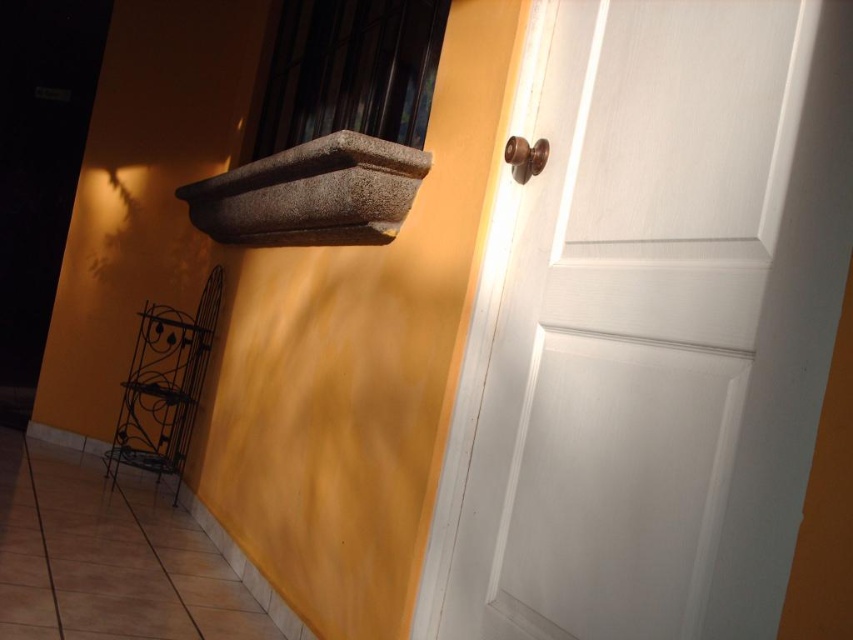
Question: Which point is closer to the camera taking this photo?

Choices:
 (A) (811, 417)
 (B) (512, 156)

Answer: (A)

Question: Does white wood door at right come behind granite ledge at upper left?

Choices:
 (A) no
 (B) yes

Answer: (A)

Question: Observing the image, what is the correct spatial positioning of white wood door at right in reference to granite ledge at upper left?

Choices:
 (A) below
 (B) above

Answer: (A)

Question: Which object is farther from the camera taking this photo?

Choices:
 (A) granite ledge at upper left
 (B) white wood door at right
 (C) brown polished door handle at upper right

Answer: (A)

Question: Does white wood door at right have a larger size compared to brown polished door handle at upper right?

Choices:
 (A) no
 (B) yes

Answer: (B)

Question: Among these points, which one is farthest from the camera?

Choices:
 (A) (850, 81)
 (B) (254, 224)
 (C) (546, 147)

Answer: (B)